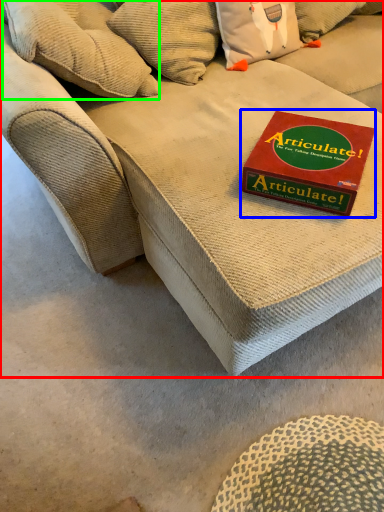
Question: Which is farther away from studio couch (highlighted by a red box)? paperback book (highlighted by a blue box) or pillow (highlighted by a green box)?

Choices:
 (A) paperback book
 (B) pillow

Answer: (B)